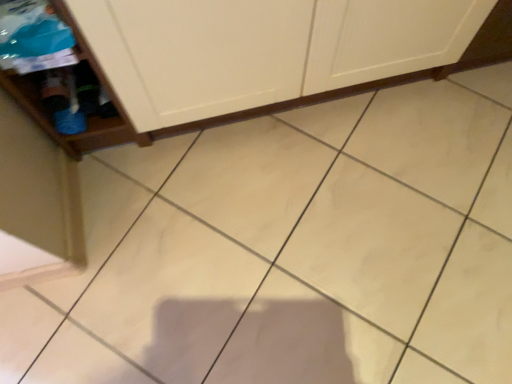
Describe the element at coordinates (254, 108) in the screenshot. I see `white matte cabinet at upper center` at that location.

Locate an element on the screen. white matte cabinet at upper center is located at coordinates (254, 108).

The height and width of the screenshot is (384, 512). I want to click on white matte cabinet at upper center, so click(254, 108).